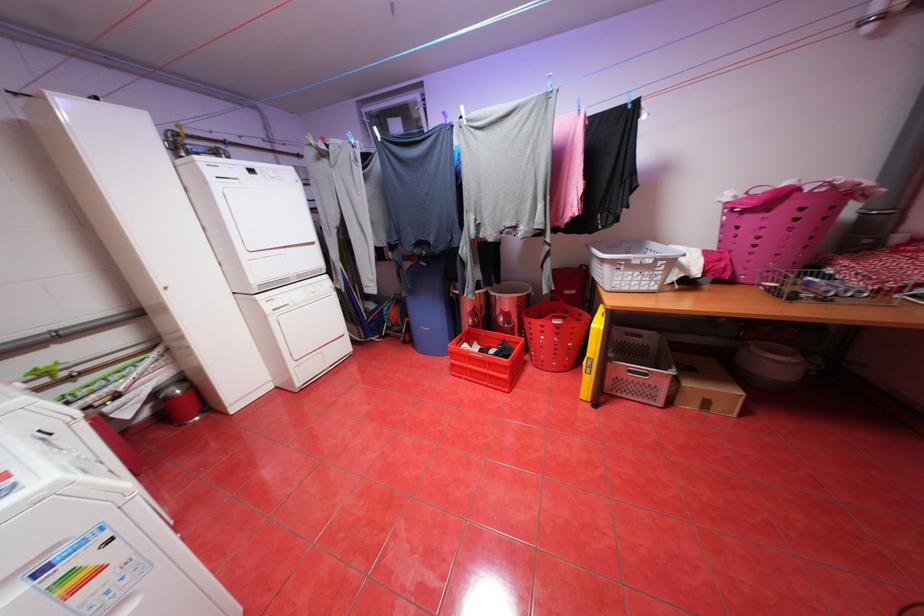
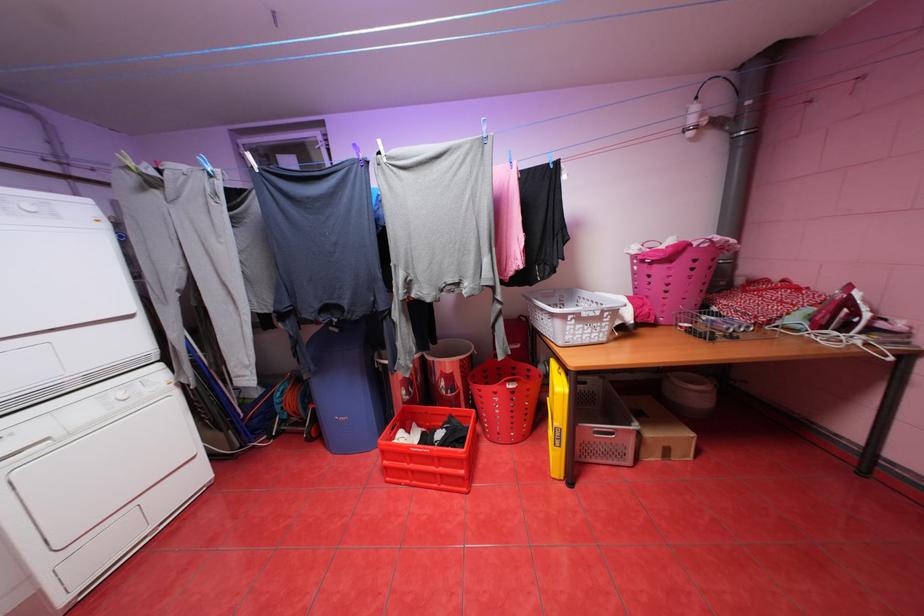
Question: The camera is either moving clockwise (left) or counter-clockwise (right) around the object. The first image is from the beginning of the video and the second image is from the end. Is the camera moving left or right when shooting the video?

Choices:
 (A) Left
 (B) Right

Answer: (A)